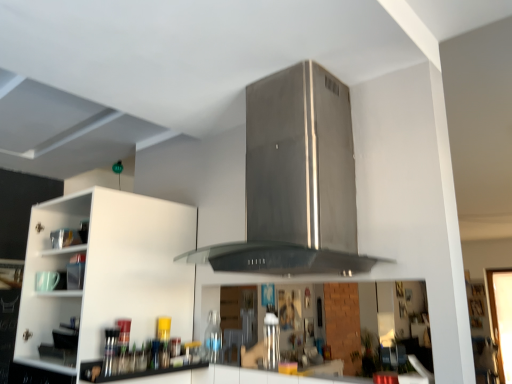
Question: Is satin silver canister at center a part of white matte cabinet at left?

Choices:
 (A) no
 (B) yes

Answer: (A)

Question: Does white matte cabinet at left appear on the right side of satin silver canister at center?

Choices:
 (A) no
 (B) yes

Answer: (A)

Question: Does white matte cabinet at left have a smaller size compared to satin silver canister at center?

Choices:
 (A) no
 (B) yes

Answer: (A)

Question: From the image's perspective, is white matte cabinet at left under satin silver canister at center?

Choices:
 (A) yes
 (B) no

Answer: (B)

Question: Can we say white matte cabinet at left lies outside satin silver canister at center?

Choices:
 (A) no
 (B) yes

Answer: (B)

Question: Is white matte cabinet at left inside the boundaries of transparent glass bottle at center, or outside?

Choices:
 (A) outside
 (B) inside

Answer: (A)

Question: Is white matte cabinet at left in front of or behind transparent glass bottle at center in the image?

Choices:
 (A) behind
 (B) front

Answer: (B)

Question: From a real-world perspective, is white matte cabinet at left physically located above or below transparent glass bottle at center?

Choices:
 (A) above
 (B) below

Answer: (A)

Question: From their relative heights in the image, would you say white matte cabinet at left is taller or shorter than transparent glass bottle at center?

Choices:
 (A) short
 (B) tall

Answer: (B)

Question: Considering the positions of transparent glass bottle at center and satin silver canister at center in the image, is transparent glass bottle at center wider or thinner than satin silver canister at center?

Choices:
 (A) thin
 (B) wide

Answer: (A)

Question: From a real-world perspective, is transparent glass bottle at center above or below satin silver canister at center?

Choices:
 (A) below
 (B) above

Answer: (B)

Question: Visually, is transparent glass bottle at center positioned to the left or to the right of satin silver canister at center?

Choices:
 (A) right
 (B) left

Answer: (B)

Question: Considering their positions, is transparent glass bottle at center located in front of or behind satin silver canister at center?

Choices:
 (A) front
 (B) behind

Answer: (B)

Question: From the image's perspective, relative to transparent glass bottle at center, is stainless steel vent at center above or below?

Choices:
 (A) below
 (B) above

Answer: (B)

Question: From a real-world perspective, is stainless steel vent at center physically located above or below transparent glass bottle at center?

Choices:
 (A) below
 (B) above

Answer: (B)